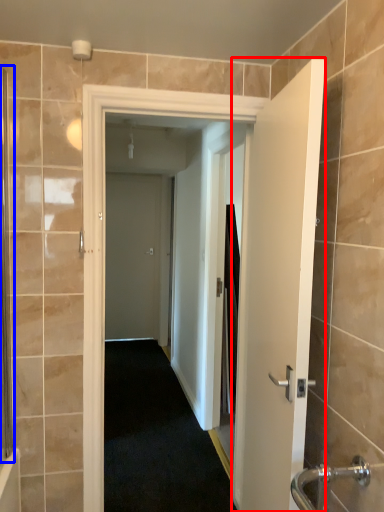
Question: Among these objects, which one is nearest to the camera, door (highlighted by a red box) or screen door (highlighted by a blue box)?

Choices:
 (A) door
 (B) screen door

Answer: (A)